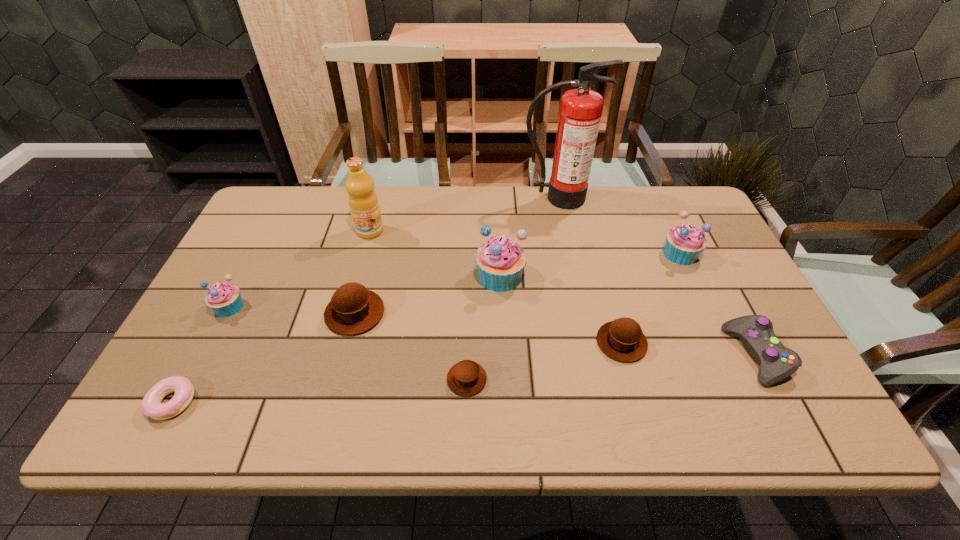
Select which brown muffin is the second closest to the shortest muffin. Please provide its 2D coordinates. Your answer should be formatted as a tuple, i.e. [(x, y)], where the tuple contains the x and y coordinates of a point satisfying the conditions above.

[(623, 340)]

Locate an element on the screen. The image size is (960, 540). the second closest brown muffin to the fifth tallest muffin is located at coordinates (353, 309).

Find the location of a particular element. The height and width of the screenshot is (540, 960). vacant space that satisfies the following two spatial constraints: 1. on the back side of the biggest blue muffin; 2. on the left side of the ninth tallest object is located at coordinates (469, 276).

Locate an element on the screen. Image resolution: width=960 pixels, height=540 pixels. vacant space that satisfies the following two spatial constraints: 1. on the back side of the shortest object; 2. on the left side of the second shortest muffin is located at coordinates tap(204, 342).

This screenshot has height=540, width=960. What are the coordinates of `vacant area in the image that satisfies the following two spatial constraints: 1. on the front label of the ninth shortest object; 2. on the right side of the second biggest blue muffin` in the screenshot? It's located at (364, 254).

Locate an element on the screen. The width and height of the screenshot is (960, 540). free location that satisfies the following two spatial constraints: 1. on the front-facing side of the fire extinguisher; 2. on the right side of the gray control is located at coordinates (588, 355).

This screenshot has width=960, height=540. Find the location of `free space that satisfies the following two spatial constraints: 1. on the back side of the second brown muffin from left to right; 2. on the right side of the second muffin from right to left`. free space that satisfies the following two spatial constraints: 1. on the back side of the second brown muffin from left to right; 2. on the right side of the second muffin from right to left is located at coordinates (468, 342).

You are a GUI agent. You are given a task and a screenshot of the screen. Output one action in this format:
    pyautogui.click(x=<x>, y=<y>)
    Task: Click on the vacant position in the image that satisfies the following two spatial constraints: 1. on the front-facing side of the rightmost blue muffin; 2. on the left side of the farthest object
    Image resolution: width=960 pixels, height=540 pixels.
    Given the screenshot: What is the action you would take?
    pyautogui.click(x=568, y=254)